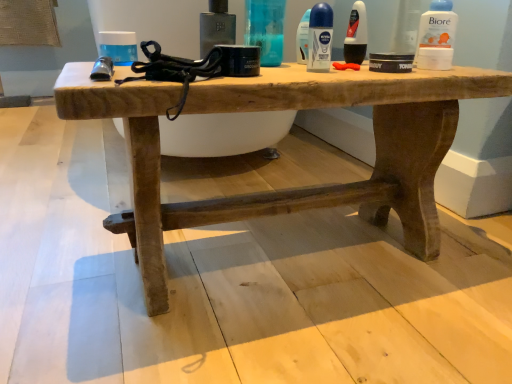
The height and width of the screenshot is (384, 512). Identify the location of free space to the left of rustic wood table at center. (65, 230).